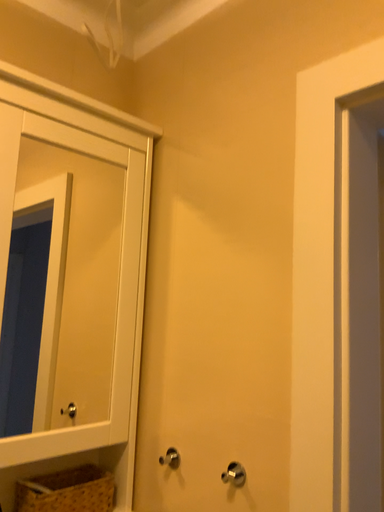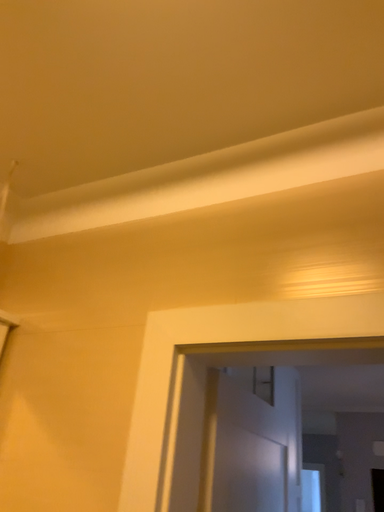
Question: How did the camera likely rotate when shooting the video?

Choices:
 (A) rotated right
 (B) rotated left

Answer: (A)